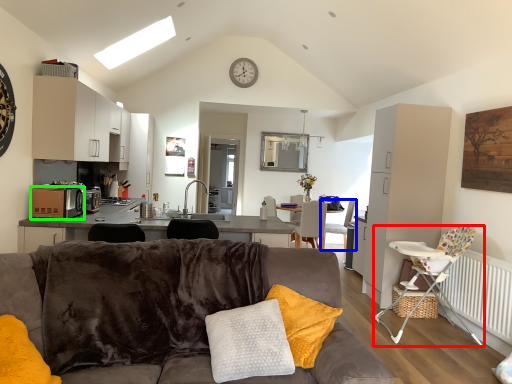
Question: Estimate the real-world distances between objects in this image. Which object is farther from chair (highlighted by a red box), chair (highlighted by a blue box) or kitchen appliance (highlighted by a green box)?

Choices:
 (A) chair
 (B) kitchen appliance

Answer: (B)